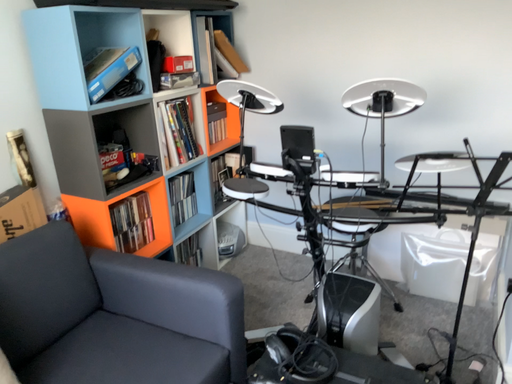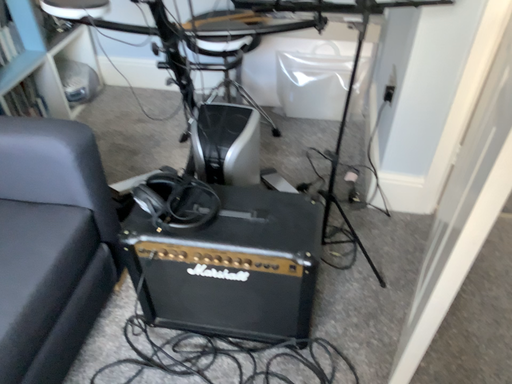
Question: Which way did the camera rotate in the video?

Choices:
 (A) rotated left
 (B) rotated right

Answer: (B)